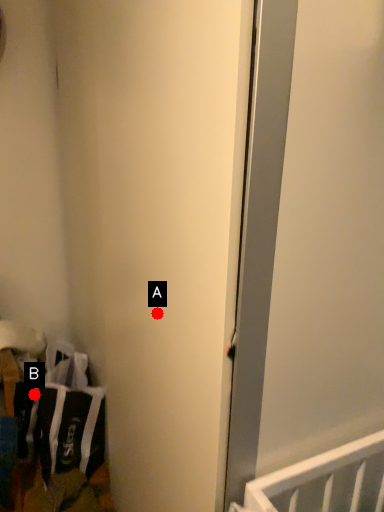
Question: Two points are circled on the image, labeled by A and B beside each circle. Among these points, which one is nearest to the camera?

Choices:
 (A) A is closer
 (B) B is closer

Answer: (A)